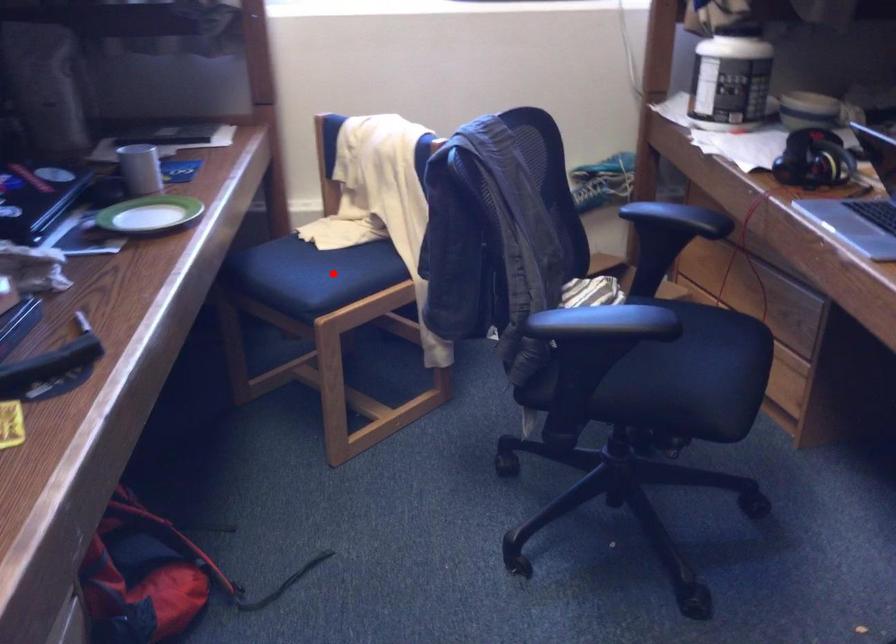
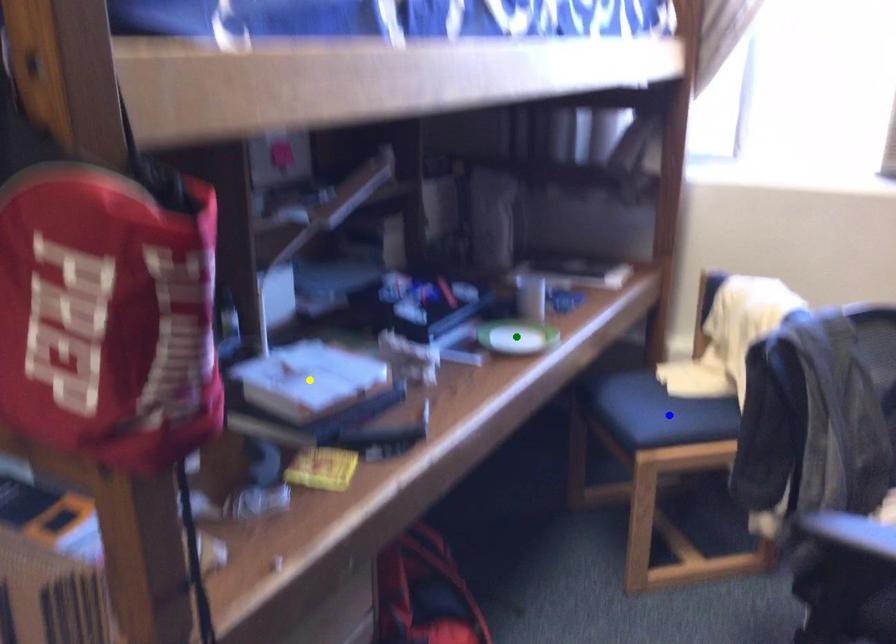
Question: I am providing you with two images of the same scene from different viewpoints. A red point is marked on the first image. You are given multiple points on the second image. Which point in image 2 represents the same 3d spot as the red point in image 1?

Choices:
 (A) green point
 (B) yellow point
 (C) blue point

Answer: (C)